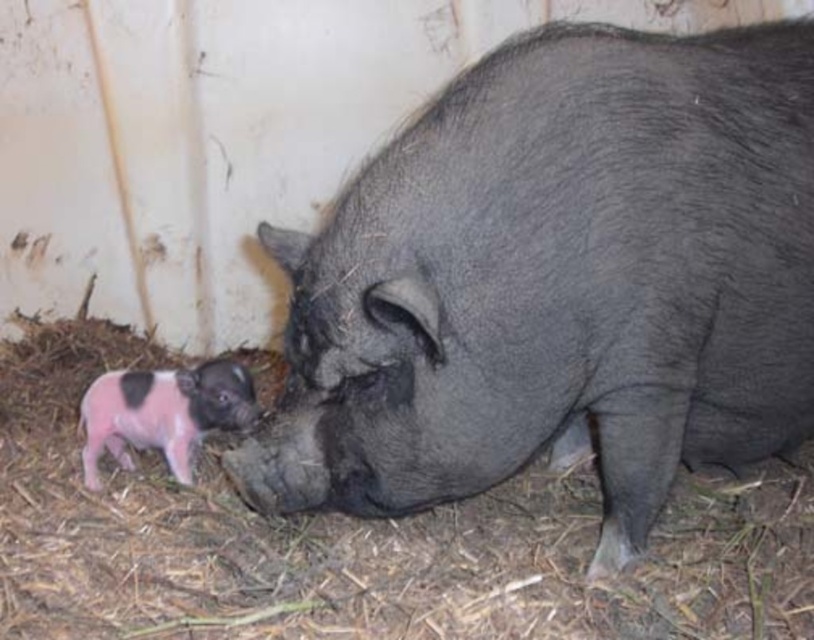
Question: Which of the following is the farthest from the observer?

Choices:
 (A) pink soft fur piglet at lower left
 (B) shiny black pig at center

Answer: (A)

Question: Where is shiny black pig at center located in relation to pink soft fur piglet at lower left in the image?

Choices:
 (A) right
 (B) left

Answer: (A)

Question: Which of the following is the closest to the observer?

Choices:
 (A) shiny black pig at center
 (B) pink soft fur piglet at lower left

Answer: (A)

Question: Is shiny black pig at center positioned before pink soft fur piglet at lower left?

Choices:
 (A) no
 (B) yes

Answer: (B)

Question: Among these objects, which one is nearest to the camera?

Choices:
 (A) shiny black pig at center
 (B) pink soft fur piglet at lower left

Answer: (A)

Question: Does shiny black pig at center appear under pink soft fur piglet at lower left?

Choices:
 (A) no
 (B) yes

Answer: (A)